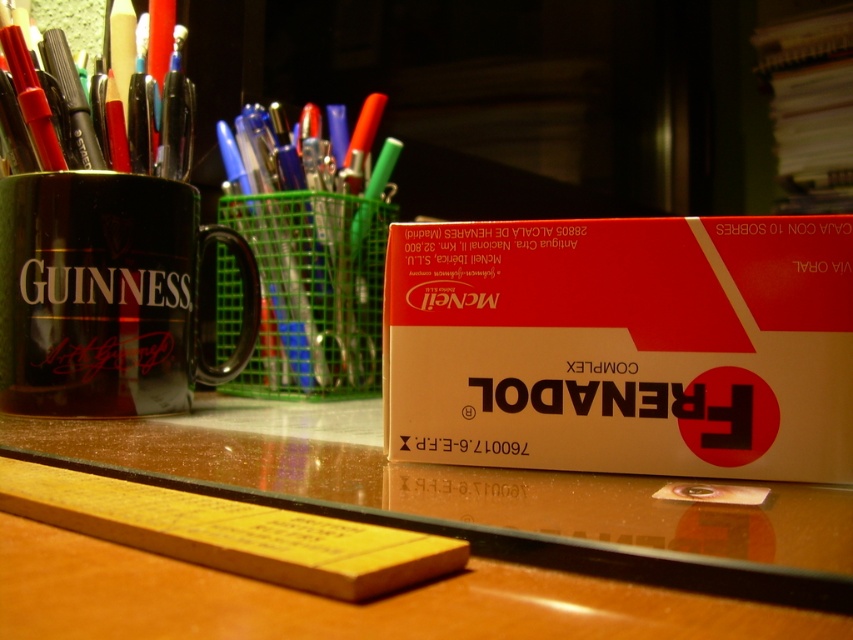
Question: Which object is positioned closest to the matte cardboard box at center?

Choices:
 (A) brown wooden table at center
 (B) matte black mug at left

Answer: (A)

Question: Is brown wooden table at center positioned before matte black pen at left?

Choices:
 (A) no
 (B) yes

Answer: (B)

Question: Is brown wooden table at center positioned at the back of matte black mug at left?

Choices:
 (A) no
 (B) yes

Answer: (A)

Question: Is brown wooden table at center to the right of translucent plastic pen holder at center from the viewer's perspective?

Choices:
 (A) yes
 (B) no

Answer: (A)

Question: Which of the following is the farthest from the observer?

Choices:
 (A) coord(321,339)
 (B) coord(486,289)

Answer: (A)

Question: Which object appears farthest from the camera in this image?

Choices:
 (A) matte cardboard box at center
 (B) matte black pen at left

Answer: (B)